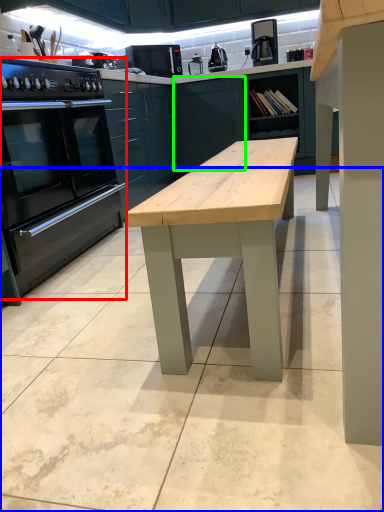
Question: Which object is positioned farthest from home appliance (highlighted by a red box)? Select from concrete (highlighted by a blue box) and cabinetry (highlighted by a green box).

Choices:
 (A) concrete
 (B) cabinetry

Answer: (B)